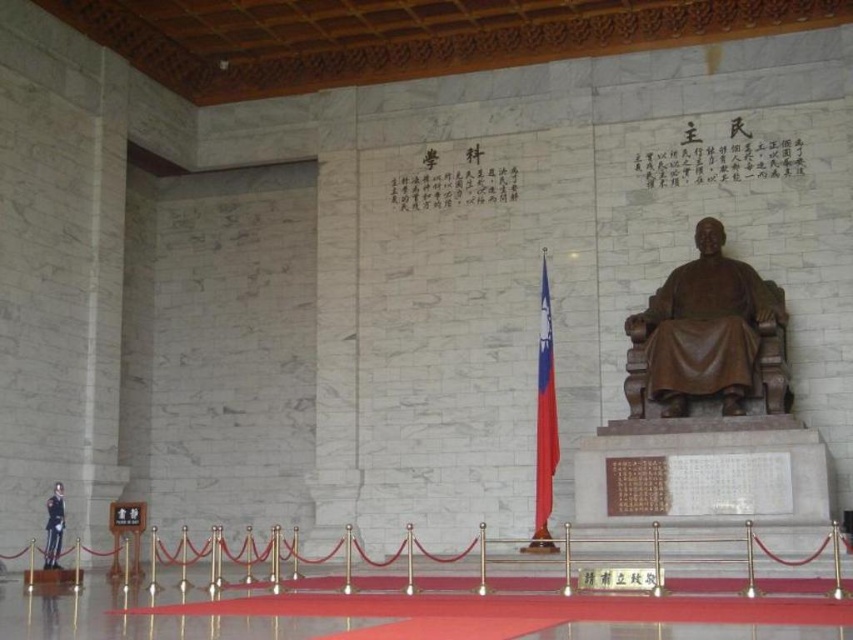
Can you confirm if red fabric flag at center is positioned below bronze statue at lower left?

No, red fabric flag at center is not below bronze statue at lower left.

This screenshot has height=640, width=853. Identify the location of red fabric flag at center. (544, 422).

Image resolution: width=853 pixels, height=640 pixels. Identify the location of red fabric flag at center. (544, 422).

Is bronze statue at center thinner than bronze statue at lower left?

Yes, bronze statue at center is thinner than bronze statue at lower left.

Which is more to the left, bronze statue at center or bronze statue at lower left?

bronze statue at lower left

The width and height of the screenshot is (853, 640). What do you see at coordinates (708, 336) in the screenshot?
I see `bronze statue at center` at bounding box center [708, 336].

Identify the location of bronze statue at center. This screenshot has width=853, height=640. (708, 336).

Can you confirm if bronze statue at center is thinner than red fabric flag at center?

Correct, bronze statue at center's width is less than red fabric flag at center's.

Can you confirm if bronze statue at center is taller than red fabric flag at center?

Incorrect, bronze statue at center's height is not larger of red fabric flag at center's.

Is point (660, 288) more distant than point (556, 424)?

Yes.

At what (x,y) coordinates should I click in order to perform the action: click on bronze statue at center. Please return your answer as a coordinate pair (x, y). Image resolution: width=853 pixels, height=640 pixels. Looking at the image, I should click on (708, 336).